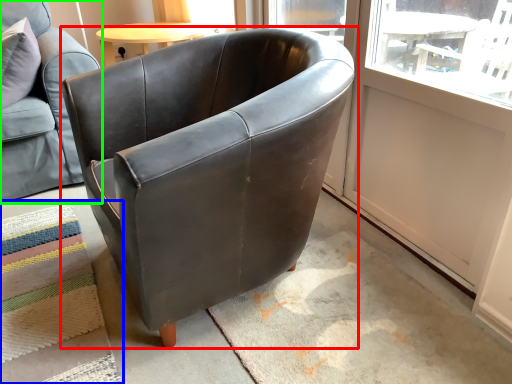
Question: Estimate the real-world distances between objects in this image. Which object is farther from chair (highlighted by a red box), mat (highlighted by a blue box) or chair (highlighted by a green box)?

Choices:
 (A) mat
 (B) chair

Answer: (B)